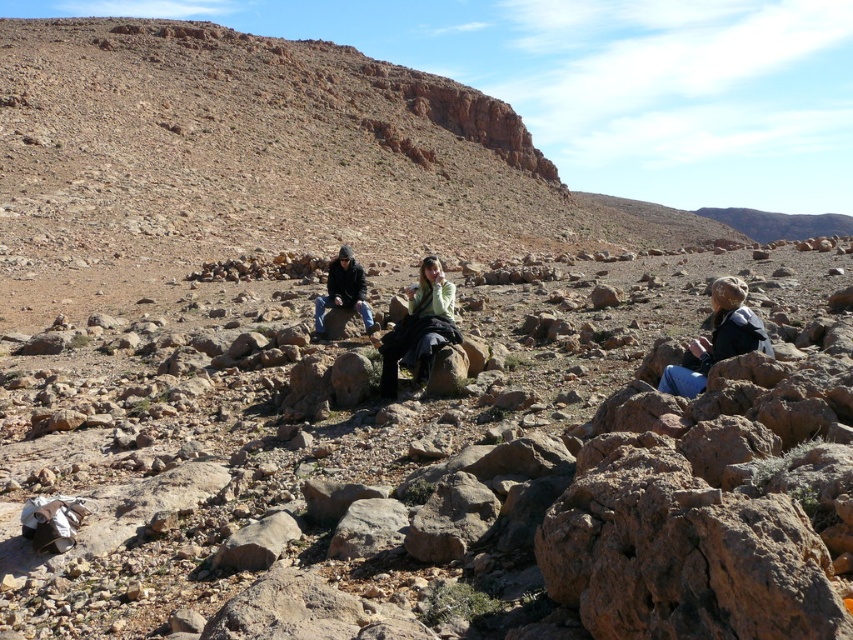
Question: Which point is closer to the camera?

Choices:
 (A) dark brown leather jacket at center
 (B) blue denim jeans at lower right
 (C) light green sweater at center

Answer: (B)

Question: Is blue denim jeans at lower right in front of dark brown leather jacket at center?

Choices:
 (A) yes
 (B) no

Answer: (A)

Question: Is light green sweater at center smaller than blue denim jeans at lower right?

Choices:
 (A) yes
 (B) no

Answer: (B)

Question: Which object appears closest to the camera in this image?

Choices:
 (A) light green sweater at center
 (B) blue denim jeans at lower right

Answer: (B)

Question: Does blue denim jeans at lower right have a greater width compared to dark brown leather jacket at center?

Choices:
 (A) yes
 (B) no

Answer: (B)

Question: Which object is closer to the camera taking this photo?

Choices:
 (A) light green sweater at center
 (B) blue denim jeans at lower right

Answer: (B)